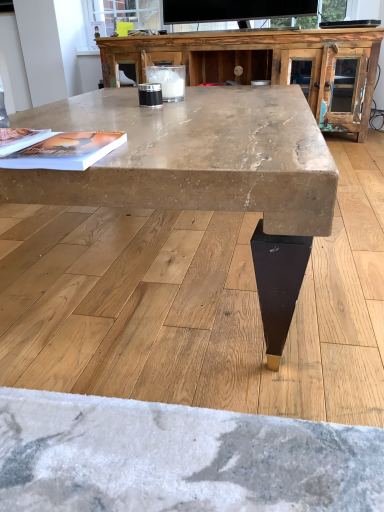
Question: Does matte paper magazine at upper left, placed as the first magazine when sorted from left to right, touch matte paper magazine at center, the 2th magazine in the left-to-right sequence?

Choices:
 (A) no
 (B) yes

Answer: (B)

Question: Considering the relative sizes of matte paper magazine at upper left, placed as the first magazine when sorted from left to right, and matte paper magazine at center, the 2th magazine in the left-to-right sequence, in the image provided, is matte paper magazine at upper left, placed as the first magazine when sorted from left to right, bigger than matte paper magazine at center, the 2th magazine in the left-to-right sequence,?

Choices:
 (A) no
 (B) yes

Answer: (B)

Question: Considering the relative positions of matte paper magazine at upper left, placed as the first magazine when sorted from left to right, and matte paper magazine at center, the 2th magazine in the left-to-right sequence, in the image provided, is matte paper magazine at upper left, placed as the first magazine when sorted from left to right, to the right of matte paper magazine at center, the 2th magazine in the left-to-right sequence, from the viewer's perspective?

Choices:
 (A) no
 (B) yes

Answer: (A)

Question: Is matte paper magazine at upper left, which is the second magazine from right to left, positioned with its back to matte paper magazine at center, which appears as the 1th magazine when viewed from the right?

Choices:
 (A) yes
 (B) no

Answer: (A)

Question: Is matte paper magazine at center, the 2th magazine in the left-to-right sequence, inside matte paper magazine at upper left, placed as the first magazine when sorted from left to right?

Choices:
 (A) yes
 (B) no

Answer: (B)

Question: Is marble-like wood coffee table at center in front of or behind rustic wood entertainment center at upper center in the image?

Choices:
 (A) behind
 (B) front

Answer: (B)

Question: Considering the positions of marble-like wood coffee table at center and rustic wood entertainment center at upper center in the image, is marble-like wood coffee table at center wider or thinner than rustic wood entertainment center at upper center?

Choices:
 (A) thin
 (B) wide

Answer: (B)

Question: From the image's perspective, is marble-like wood coffee table at center above or below rustic wood entertainment center at upper center?

Choices:
 (A) below
 (B) above

Answer: (A)

Question: Is point (46, 188) closer or farther from the camera than point (317, 57)?

Choices:
 (A) farther
 (B) closer

Answer: (B)

Question: In terms of height, does matte paper magazine at upper left, placed as the first magazine when sorted from left to right, look taller or shorter compared to matte paper magazine at center, which appears as the 1th magazine when viewed from the right?

Choices:
 (A) tall
 (B) short

Answer: (B)

Question: From a real-world perspective, is matte paper magazine at upper left, which is the second magazine from right to left, physically located above or below matte paper magazine at center, which appears as the 1th magazine when viewed from the right?

Choices:
 (A) above
 (B) below

Answer: (A)

Question: Is matte paper magazine at upper left, which is the second magazine from right to left, bigger or smaller than matte paper magazine at center, which appears as the 1th magazine when viewed from the right?

Choices:
 (A) big
 (B) small

Answer: (A)

Question: Is matte paper magazine at upper left, which is the second magazine from right to left, inside the boundaries of matte paper magazine at center, the 2th magazine in the left-to-right sequence, or outside?

Choices:
 (A) outside
 (B) inside

Answer: (A)

Question: Based on their sizes in the image, would you say rustic wood entertainment center at upper center is bigger or smaller than marble-like wood coffee table at center?

Choices:
 (A) big
 (B) small

Answer: (B)

Question: Considering the positions of rustic wood entertainment center at upper center and marble-like wood coffee table at center in the image, is rustic wood entertainment center at upper center wider or thinner than marble-like wood coffee table at center?

Choices:
 (A) wide
 (B) thin

Answer: (B)